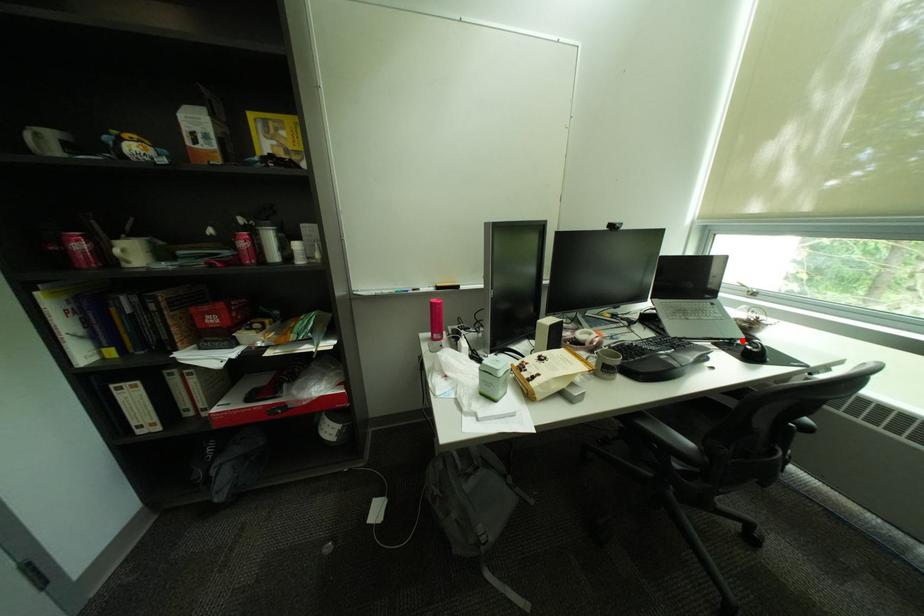
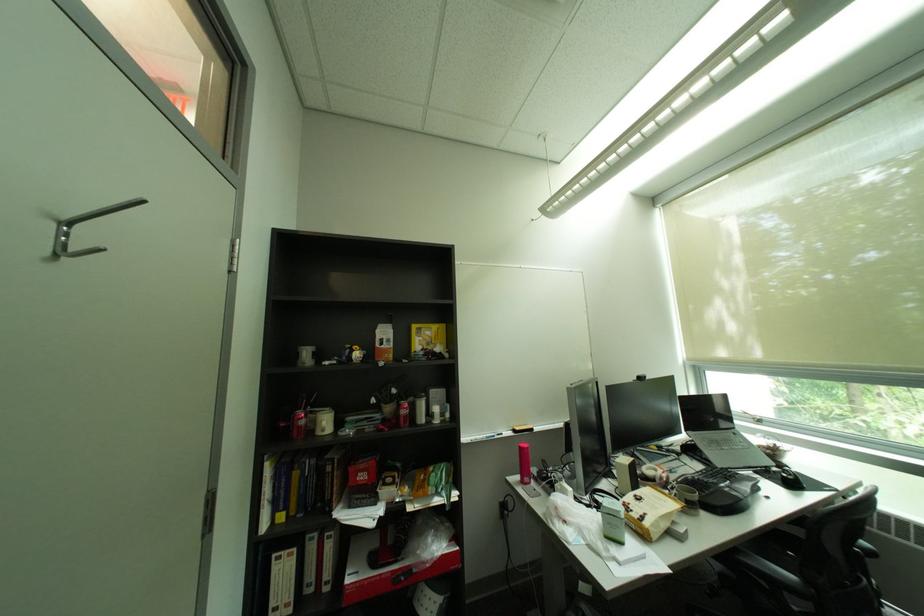
In the second image, find the point that corresponds to the highlighted location in the first image.

(777, 468)